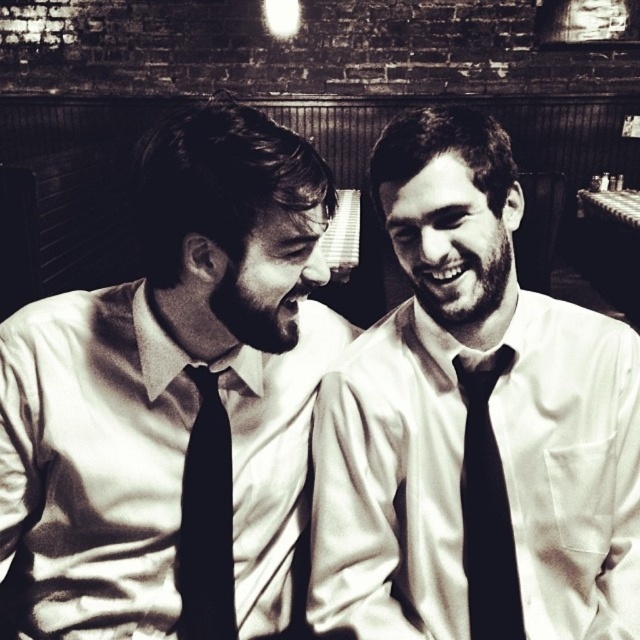
Is black silk tie at center wider than black silk tie at right?

No, black silk tie at center is not wider than black silk tie at right.

Does black silk tie at center appear under black silk tie at right?

Indeed, black silk tie at center is positioned under black silk tie at right.

Identify the location of black silk tie at center. (205, 520).

This screenshot has width=640, height=640. Identify the location of black silk tie at center. (205, 520).

Is matte black tie at left wider than matte white shirt and tie at center?

Indeed, matte black tie at left has a greater width compared to matte white shirt and tie at center.

Does matte black tie at left appear on the right side of matte white shirt and tie at center?

Incorrect, matte black tie at left is not on the right side of matte white shirt and tie at center.

Is point (264, 172) positioned in front of point (490, 417)?

Yes, it is in front of point (490, 417).

Where is `matte black tie at left`? matte black tie at left is located at coordinates (176, 400).

Which of these two, matte black tie at left or black silk tie at right, stands shorter?

With less height is black silk tie at right.

Does matte black tie at left appear on the left side of black silk tie at right?

Correct, you'll find matte black tie at left to the left of black silk tie at right.

Who is more distant from viewer, (68, 416) or (481, 380)?

The point (481, 380) is more distant.

Where is `matte black tie at left`? This screenshot has width=640, height=640. matte black tie at left is located at coordinates (176, 400).